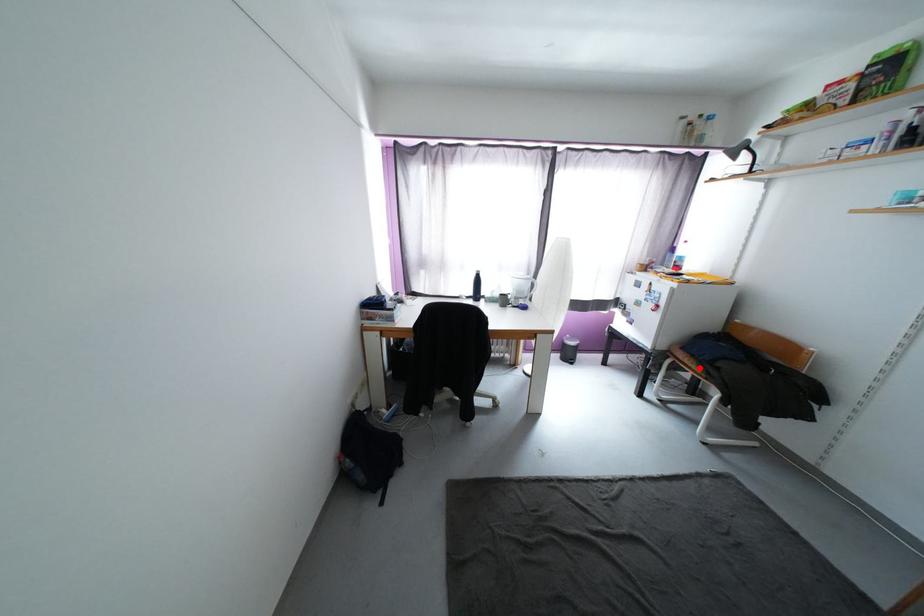
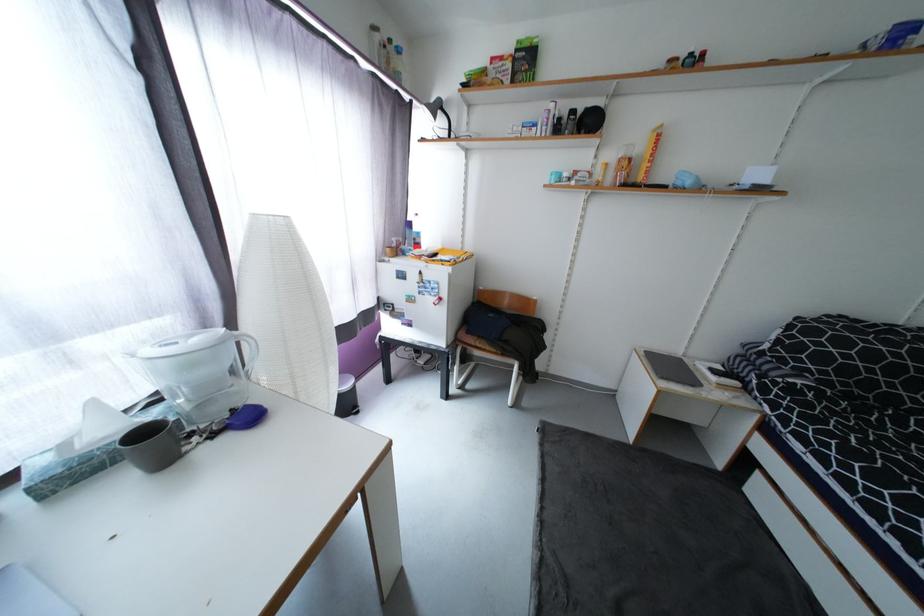
Question: I am providing you with two images of the same scene from different viewpoints. Image1 has a red point marked. In image2, the corresponding 3D location appears at what relative position? Reply with the corresponding letter.

Choices:
 (A) Closer
 (B) Farther

Answer: (B)